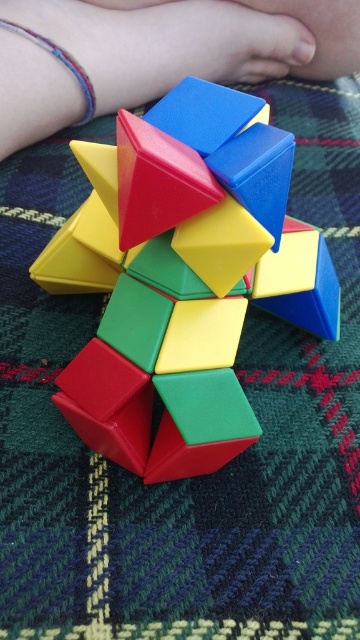
Question: Which point is farther from the camera taking this photo?

Choices:
 (A) (281, 17)
 (B) (195, 236)

Answer: (A)

Question: Is rubberized plastic puzzle at center wider than rubberized plastic toy at center?

Choices:
 (A) no
 (B) yes

Answer: (A)

Question: Is rubberized plastic puzzle at center to the left of rubberized plastic toy at center from the viewer's perspective?

Choices:
 (A) no
 (B) yes

Answer: (B)

Question: Does rubberized plastic puzzle at center appear on the right side of rubberized plastic toy at center?

Choices:
 (A) no
 (B) yes

Answer: (A)